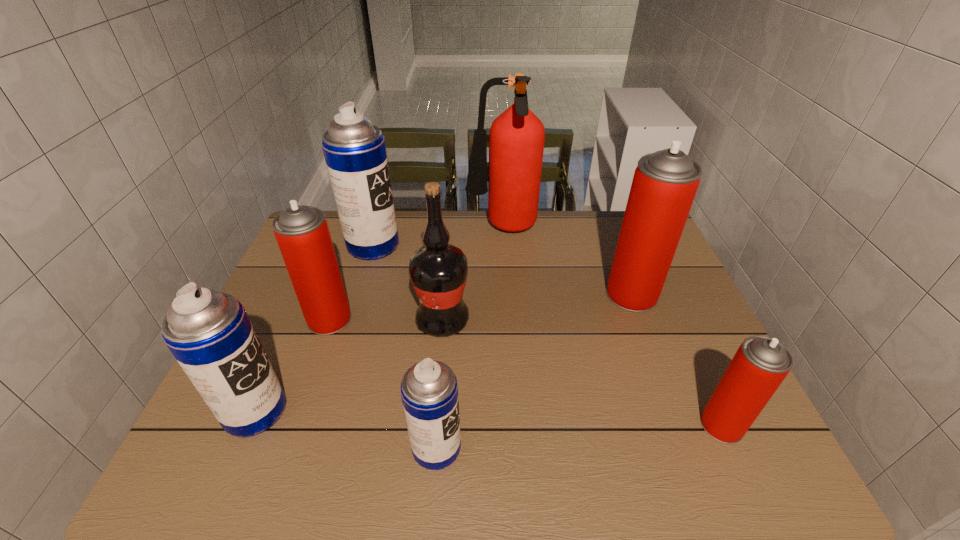
Locate an element on the screen. free spot located at the nozzle of the fire extinguisher is located at coordinates (442, 230).

Find the location of a particular element. Image resolution: width=960 pixels, height=540 pixels. free space located at the nozzle of the fire extinguisher is located at coordinates pos(421,230).

Find the location of `vacant area situated 0.340m at the nozzle of the fire extinguisher`. vacant area situated 0.340m at the nozzle of the fire extinguisher is located at coordinates (364, 230).

Locate an element on the screen. This screenshot has height=540, width=960. vacant space situated 0.050m on the label side of the farthest blue aerosol can is located at coordinates (415, 245).

Find the location of a particular element. vacant area situated 0.140m on the left of the biggest red aerosol can is located at coordinates (557, 294).

Where is `free region located on the right of the red wine bottle`? This screenshot has height=540, width=960. free region located on the right of the red wine bottle is located at coordinates (572, 321).

Find the location of a particular element. The image size is (960, 540). free location located on the front of the second smallest red aerosol can is located at coordinates (283, 451).

Where is `free location located 0.100m on the label side of the second smallest blue aerosol can`? The height and width of the screenshot is (540, 960). free location located 0.100m on the label side of the second smallest blue aerosol can is located at coordinates (331, 410).

You are a GUI agent. You are given a task and a screenshot of the screen. Output one action in this format:
    pyautogui.click(x=<x>, y=<y>)
    Task: Click on the vacant space located on the back of the nearest red aerosol can
    
    Given the screenshot: What is the action you would take?
    pyautogui.click(x=659, y=285)

In order to click on free space located 0.110m on the label side of the smallest blue aerosol can in this screenshot , I will do `click(516, 447)`.